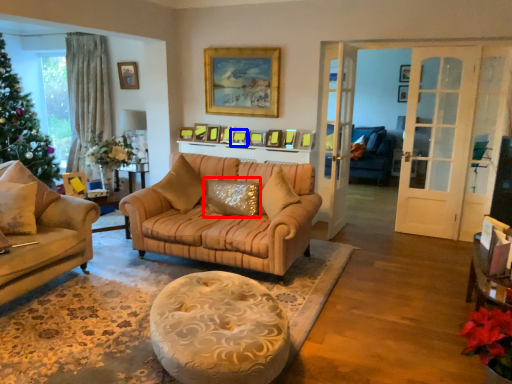
Question: Which point is closer to the camera, pillow (highlighted by a red box) or picture frame (highlighted by a blue box)?

Choices:
 (A) pillow
 (B) picture frame

Answer: (A)